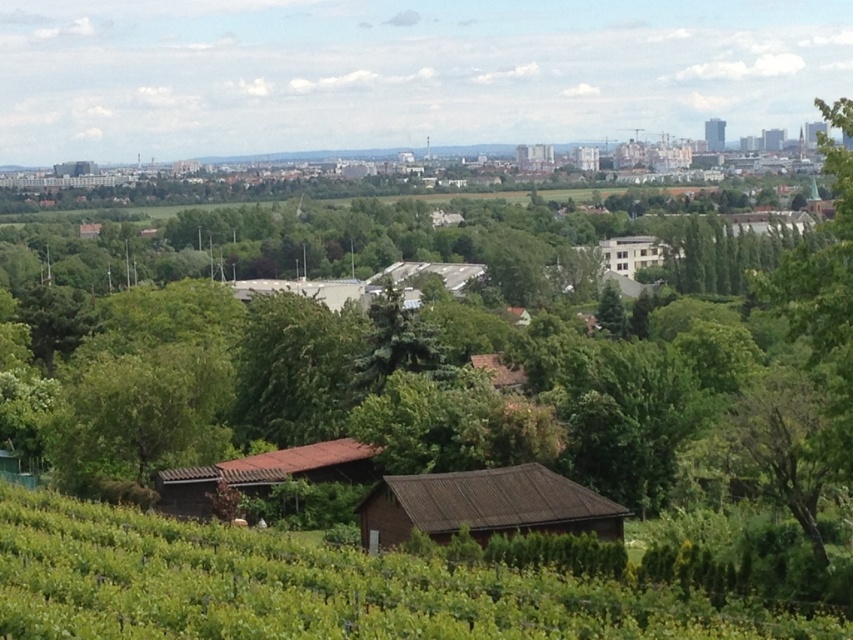
Between point (271, 486) and point (518, 371), which one is positioned in front?

Point (271, 486) is more forward.

Is point (250, 476) closer to camera compared to point (491, 358)?

Yes, it is.

Which is in front, point (194, 493) or point (508, 380)?

Point (194, 493) is in front.

Find the location of a particular element. The image size is (853, 640). brown wooden hut at lower left is located at coordinates click(262, 474).

Which is more to the right, green grassy hillside at lower center or brown wooden hut at lower left?

green grassy hillside at lower center is more to the right.

Which is behind, point (616, 593) or point (183, 490)?

Point (183, 490)

Which is in front, point (108, 532) or point (245, 468)?

Point (108, 532)

Where is `green grassy hillside at lower center`? The image size is (853, 640). green grassy hillside at lower center is located at coordinates (308, 588).

I want to click on brown corrugated roof hut at center, so click(485, 506).

Which is in front, point (380, 524) or point (428, 264)?

Point (380, 524) is in front.

Is point (560, 512) positioned in front of point (410, 269)?

Yes.

In order to click on brown corrugated roof hut at center in this screenshot , I will do `click(485, 506)`.